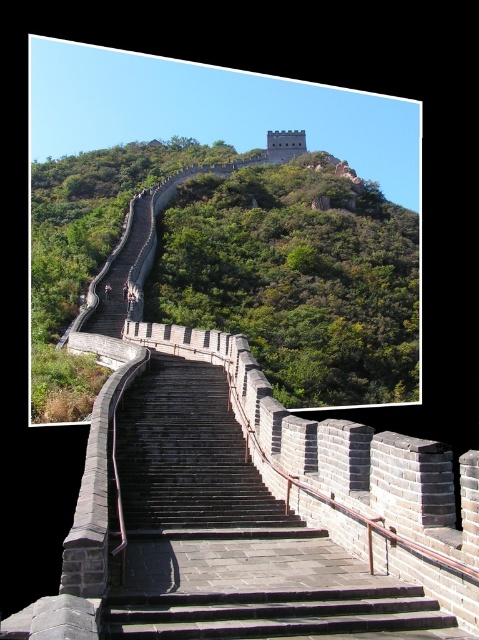
You are a tourist standing on the dark gray stone stairs at center and want to reach the green stone wall at upper center. Which direction should you move towards?

You should move to the right because the dark gray stone stairs at center are to the left of the green stone wall at upper center, so moving right would lead you towards it.

You are a tourist standing at the base of the Great Wall and want to reach the watchtower located at the top. You see the dark gray stone stairs at center and the green stone wall at upper center. Which object should you climb first to reach the watchtower?

You should climb the dark gray stone stairs at center first because they are located below the green stone wall at upper center, which is closer to the watchtower.

You are a tourist standing at the base of the Great Wall. You see the dark gray stone stairs at center and the green stone wall at upper center. Which object is closer to you?

The dark gray stone stairs at center is closer to you because it is smaller than the green stone wall at upper center.